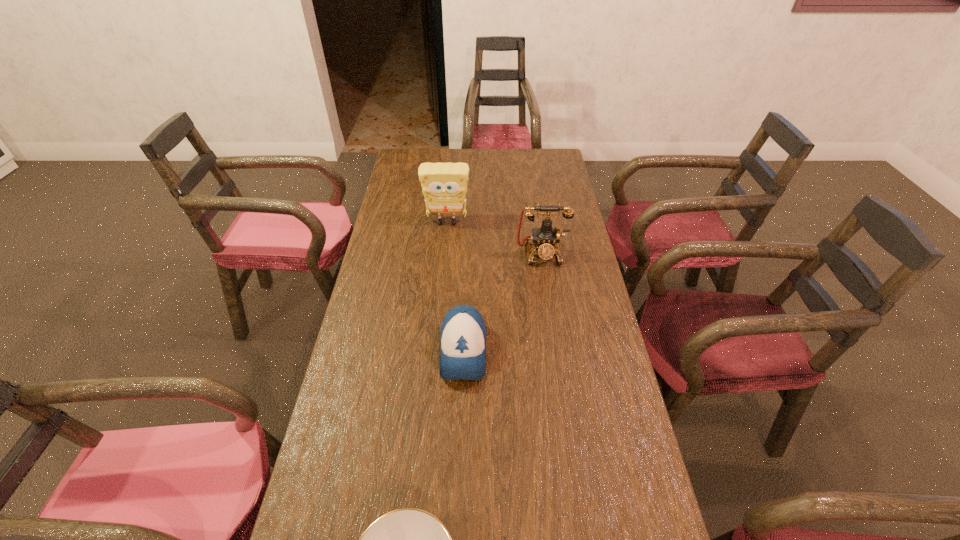
Where is `sponge`? sponge is located at coordinates (444, 185).

Where is `the rightmost object`? This screenshot has height=540, width=960. the rightmost object is located at coordinates (546, 239).

The image size is (960, 540). I want to click on telephone, so pos(546,239).

The width and height of the screenshot is (960, 540). Identify the location of the third farthest object. 463,333.

Identify the location of vacant space located on the face of the farthest object. This screenshot has width=960, height=540. (444, 248).

The height and width of the screenshot is (540, 960). I want to click on vacant point located 0.150m on the front of the second farthest object, featuring the rotary dial, so click(548, 300).

Locate an element on the screen. vacant space located 0.100m on the front-facing side of the third farthest object is located at coordinates click(461, 423).

Image resolution: width=960 pixels, height=540 pixels. I want to click on object present at the left edge, so click(x=444, y=185).

You are a GUI agent. You are given a task and a screenshot of the screen. Output one action in this format:
    pyautogui.click(x=<x>, y=<y>)
    Task: Click on the object present at the right edge
    The image size is (960, 540).
    Given the screenshot: What is the action you would take?
    pyautogui.click(x=546, y=239)

Locate an element on the screen. The height and width of the screenshot is (540, 960). vacant space at the far edge is located at coordinates (466, 156).